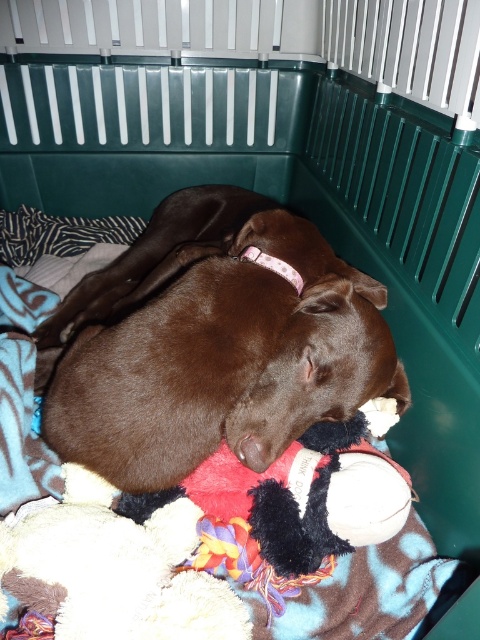
Question: Which object appears farthest from the camera in this image?

Choices:
 (A) soft plush dog bed at center
 (B) brown smooth dog at center

Answer: (A)

Question: Does brown smooth dog at center appear on the left side of soft plush dog bed at center?

Choices:
 (A) yes
 (B) no

Answer: (B)

Question: Does brown smooth dog at center come in front of soft plush dog bed at center?

Choices:
 (A) yes
 (B) no

Answer: (A)

Question: Among these objects, which one is farthest from the camera?

Choices:
 (A) brown smooth dog at center
 (B) soft plush dog bed at center

Answer: (B)

Question: Which point appears farthest from the camera in this image?

Choices:
 (A) (67, 458)
 (B) (375, 602)

Answer: (A)

Question: Is brown smooth dog at center wider than soft plush dog bed at center?

Choices:
 (A) no
 (B) yes

Answer: (B)